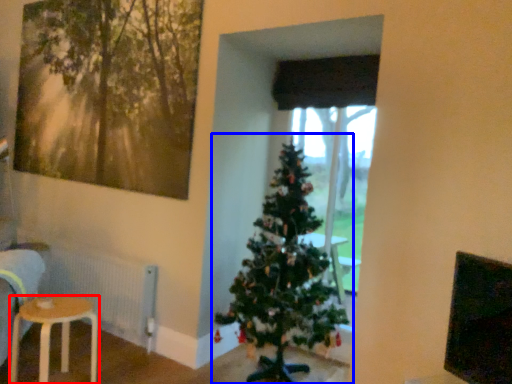
Question: Which of the following is the closest to the observer, stool (highlighted by a red box) or christmas tree (highlighted by a blue box)?

Choices:
 (A) stool
 (B) christmas tree

Answer: (B)